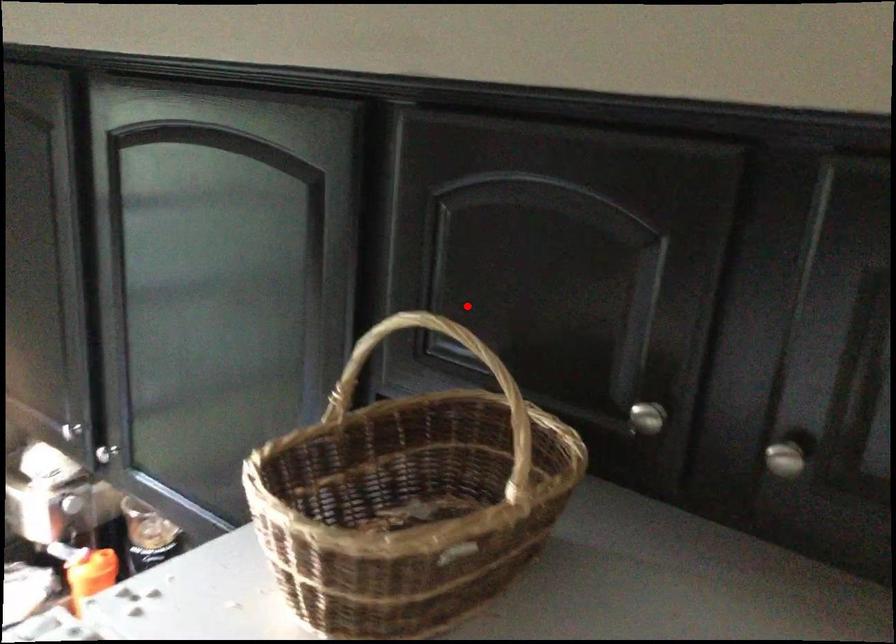
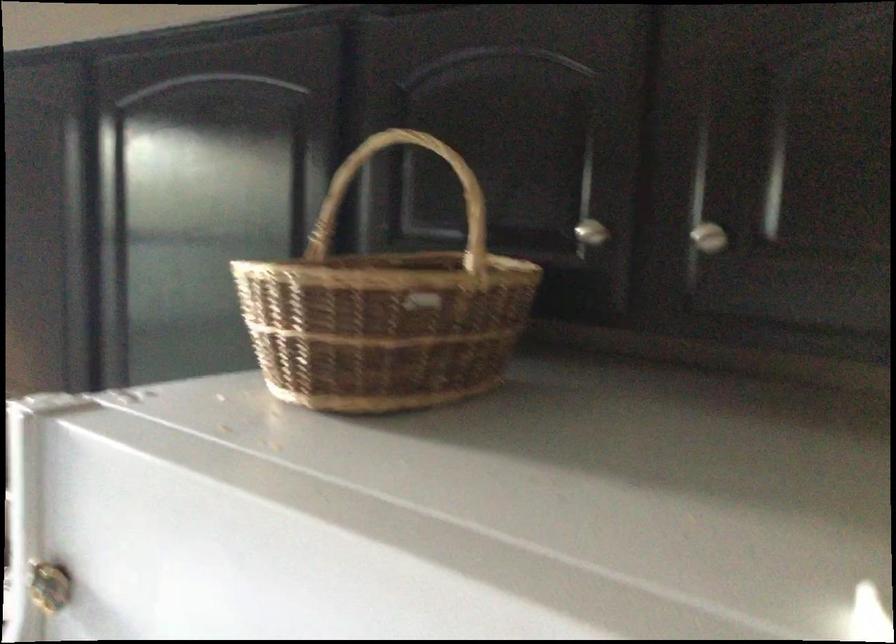
In the second image, find the point that corresponds to the highlighted location in the first image.

(428, 182)